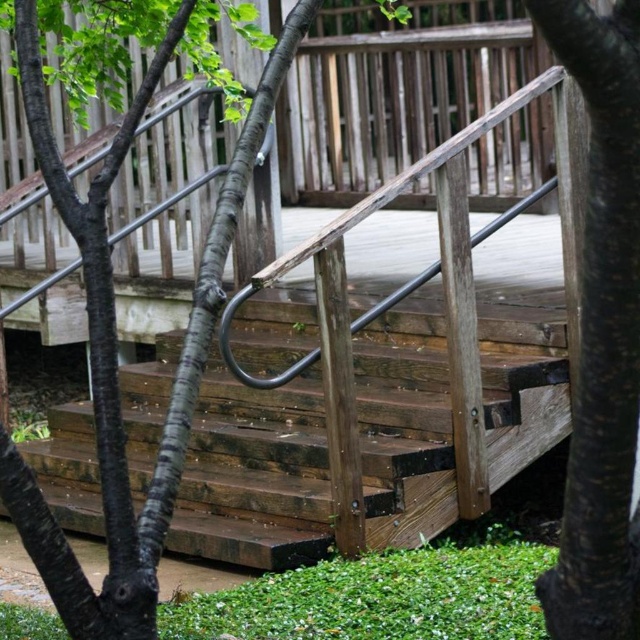
From the picture: Is weathered wood stairs at center smaller than dark brown wood at center?

No.

Does weathered wood stairs at center have a lesser height compared to dark brown wood at center?

No, weathered wood stairs at center is not shorter than dark brown wood at center.

The width and height of the screenshot is (640, 640). In order to click on weathered wood stairs at center in this screenshot , I will do `click(256, 474)`.

Find the location of a particular element. This screenshot has height=640, width=640. weathered wood stairs at center is located at coordinates (256, 474).